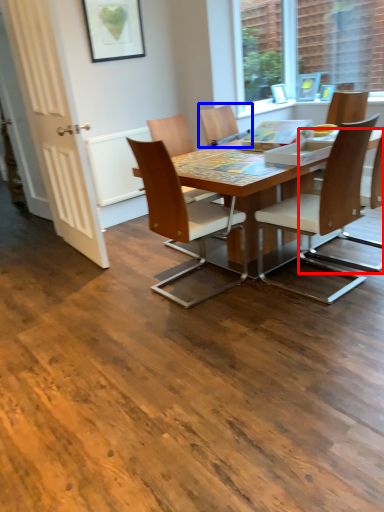
Question: Which object appears farthest to the camera in this image, chair (highlighted by a red box) or chair (highlighted by a blue box)?

Choices:
 (A) chair
 (B) chair

Answer: (B)